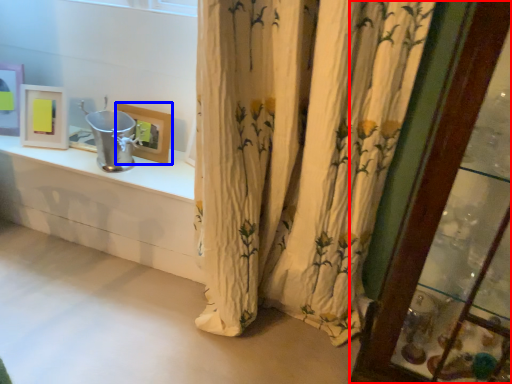
Question: Which point is closer to the camera, glass door (highlighted by a red box) or picture frame (highlighted by a blue box)?

Choices:
 (A) glass door
 (B) picture frame

Answer: (A)